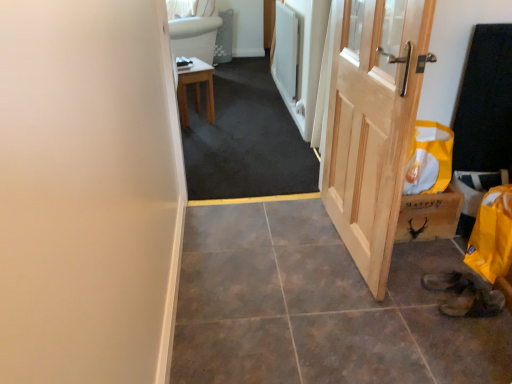
Identify the location of vacant region to the left of natural wood door at right. This screenshot has height=384, width=512. (265, 248).